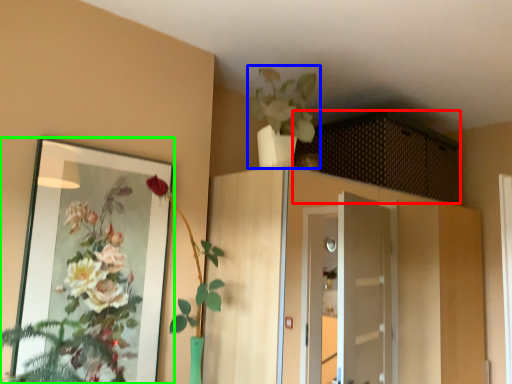
Question: Which object is positioned closest to cabinetry (highlighted by a red box)? Select from houseplant (highlighted by a blue box) and mirror (highlighted by a green box).

Choices:
 (A) houseplant
 (B) mirror

Answer: (A)